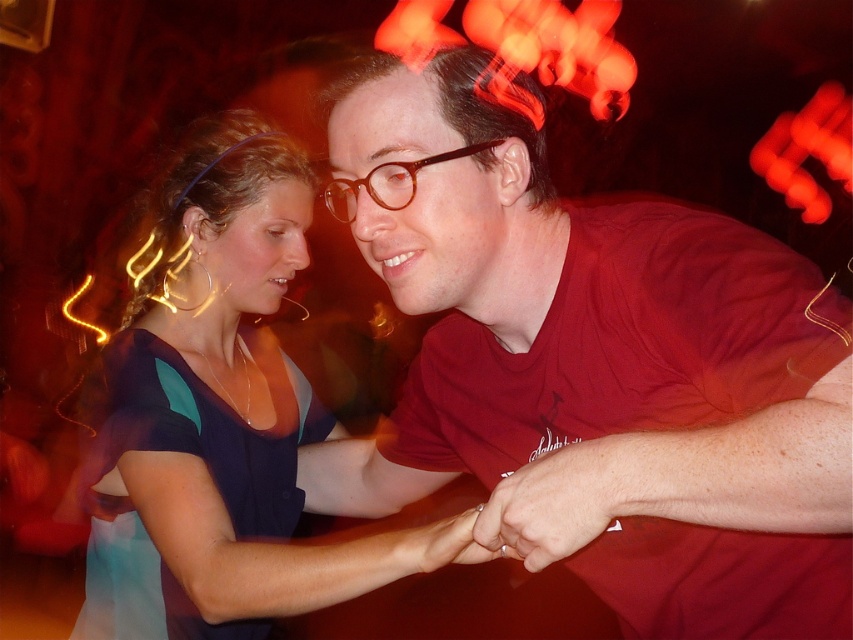
Is matte red shirt at center above brown glossy glasses at center?

Actually, matte red shirt at center is below brown glossy glasses at center.

Describe the element at coordinates (596, 376) in the screenshot. I see `matte red shirt at center` at that location.

The image size is (853, 640). In order to click on matte red shirt at center in this screenshot , I will do `click(596, 376)`.

Is matte red shirt at center below matte blue dress at center?

Yes, matte red shirt at center is below matte blue dress at center.

The height and width of the screenshot is (640, 853). I want to click on matte red shirt at center, so click(596, 376).

Looking at this image, between matte blue dress at center and brown glossy glasses at center, which one appears on the right side from the viewer's perspective?

From the viewer's perspective, brown glossy glasses at center appears more on the right side.

Can you confirm if matte blue dress at center is positioned above brown glossy glasses at center?

Actually, matte blue dress at center is below brown glossy glasses at center.

This screenshot has height=640, width=853. Identify the location of matte blue dress at center. (221, 419).